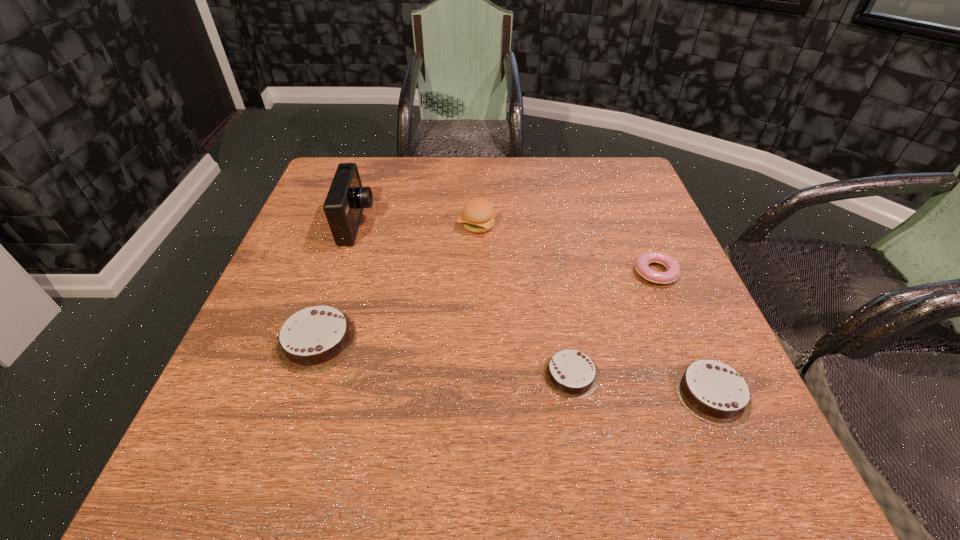
Locate an element on the screen. the leftmost chocolate cake is located at coordinates (314, 339).

The height and width of the screenshot is (540, 960). I want to click on the tallest chocolate cake, so click(314, 339).

Locate an element on the screen. This screenshot has width=960, height=540. the second chocolate cake from right to left is located at coordinates (570, 373).

Where is `the third object from right to left`? The width and height of the screenshot is (960, 540). the third object from right to left is located at coordinates (570, 373).

The height and width of the screenshot is (540, 960). Identify the location of the rightmost chocolate cake. (714, 392).

The image size is (960, 540). I want to click on camera, so click(x=346, y=199).

The height and width of the screenshot is (540, 960). What are the coordinates of `the fifth shortest object` in the screenshot? It's located at [x=478, y=214].

Identify the location of the fourth object from right to left. The height and width of the screenshot is (540, 960). (478, 214).

I want to click on the third farthest object, so click(x=671, y=265).

Find the location of `blank area located 0.060m on the left of the leftmost chocolate cake`. blank area located 0.060m on the left of the leftmost chocolate cake is located at coordinates (246, 341).